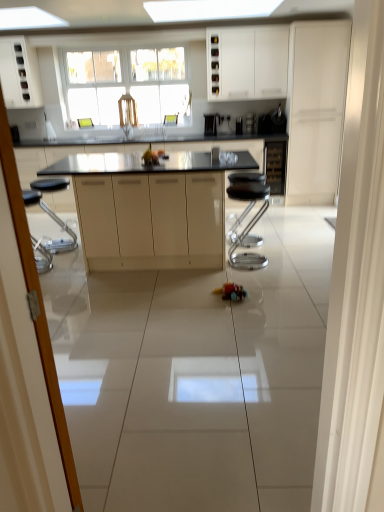
Question: From a real-world perspective, is transparent glass screen door at left positioned above or below matte beige cabinetry at center, the 4th cabinetry in the right-to-left sequence?

Choices:
 (A) above
 (B) below

Answer: (A)

Question: In the image, is transparent glass screen door at left on the left side or the right side of matte beige cabinetry at center, the 4th cabinetry in the right-to-left sequence?

Choices:
 (A) right
 (B) left

Answer: (B)

Question: Which object is the closest to the white matte cabinet at right, which is the 1th cabinetry in right-to-left order?

Choices:
 (A) white matte cabinet at upper left, placed as the first cabinetry when sorted from left to right
 (B) satin black coffee machine at center, the second appliance viewed from the right
 (C) metallic silver bar stool at center
 (D) black glass wine cabinet at center, marked as the 4th cabinetry in a left-to-right arrangement
 (E) white matte cabinet at upper center, the third cabinetry viewed from the right

Answer: (E)

Question: Based on their relative distances, which object is farther from the glossy stainless steel wine cooler at center, arranged as the third appliance when viewed from the left?

Choices:
 (A) white matte cabinet at upper center, which is the 3th cabinetry from left to right
 (B) black granite countertop at center
 (C) satin black wine cooler at upper center, which ranks as the first appliance in left-to-right order
 (D) black glass wine cabinet at center, marked as the 4th cabinetry in a left-to-right arrangement
 (E) satin black coffee machine at center, the second appliance viewed from the right

Answer: (B)